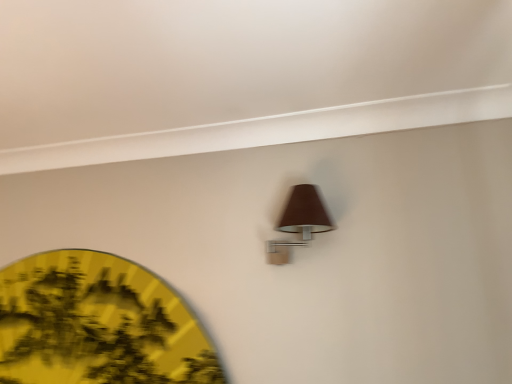
Question: Does yellow paper fan at lower left have a smaller size compared to brown fabric lamp at upper center?

Choices:
 (A) yes
 (B) no

Answer: (B)

Question: Is there a large distance between yellow paper fan at lower left and brown fabric lamp at upper center?

Choices:
 (A) yes
 (B) no

Answer: (B)

Question: Is yellow paper fan at lower left beside brown fabric lamp at upper center?

Choices:
 (A) no
 (B) yes

Answer: (A)

Question: From the image's perspective, is yellow paper fan at lower left beneath brown fabric lamp at upper center?

Choices:
 (A) no
 (B) yes

Answer: (B)

Question: Is yellow paper fan at lower left behind brown fabric lamp at upper center?

Choices:
 (A) yes
 (B) no

Answer: (A)

Question: Is brown fabric lamp at upper center at the back of yellow paper fan at lower left?

Choices:
 (A) yes
 (B) no

Answer: (B)

Question: Does brown fabric lamp at upper center have a lesser width compared to yellow paper fan at lower left?

Choices:
 (A) no
 (B) yes

Answer: (A)

Question: Is brown fabric lamp at upper center positioned before yellow paper fan at lower left?

Choices:
 (A) no
 (B) yes

Answer: (B)

Question: Is yellow paper fan at lower left at the back of brown fabric lamp at upper center?

Choices:
 (A) no
 (B) yes

Answer: (A)

Question: From the image's perspective, is brown fabric lamp at upper center below yellow paper fan at lower left?

Choices:
 (A) yes
 (B) no

Answer: (B)

Question: From a real-world perspective, is brown fabric lamp at upper center located beneath yellow paper fan at lower left?

Choices:
 (A) yes
 (B) no

Answer: (B)

Question: Is yellow paper fan at lower left completely or partially inside brown fabric lamp at upper center?

Choices:
 (A) yes
 (B) no

Answer: (B)

Question: From the image's perspective, is brown fabric lamp at upper center positioned above or below yellow paper fan at lower left?

Choices:
 (A) below
 (B) above

Answer: (B)